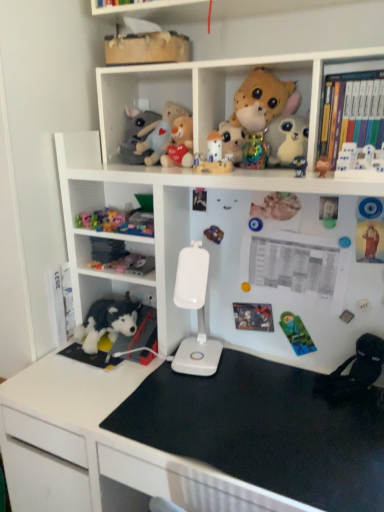
Identify the location of vacant space underneath wooden toy at upper center, arranged as the first toy when viewed from the top (from a real-world perspective). Image resolution: width=384 pixels, height=512 pixels. (146, 71).